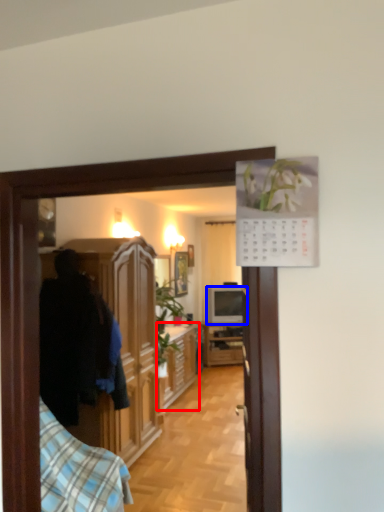
Question: Which object appears closest to the camera in this image, cabinetry (highlighted by a red box) or television (highlighted by a blue box)?

Choices:
 (A) cabinetry
 (B) television

Answer: (A)